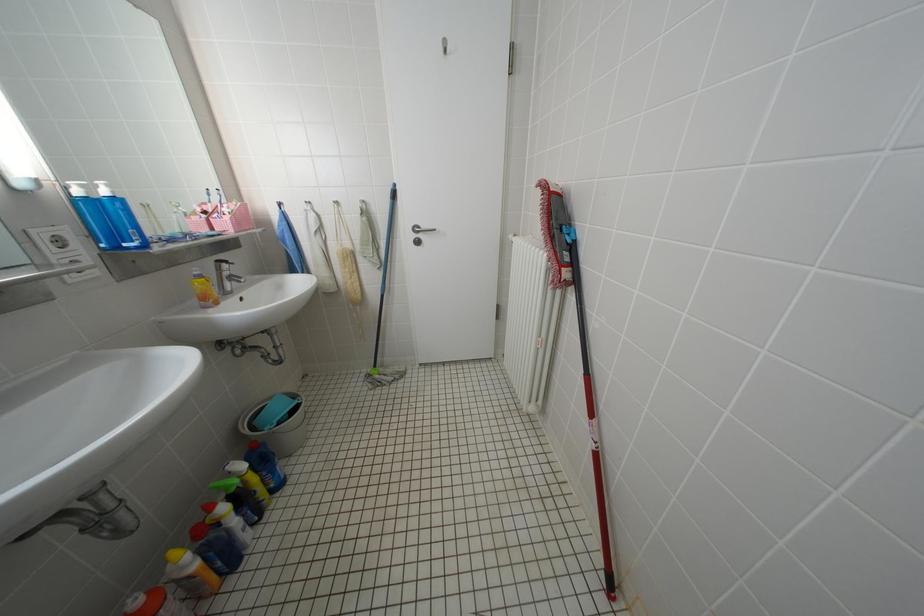
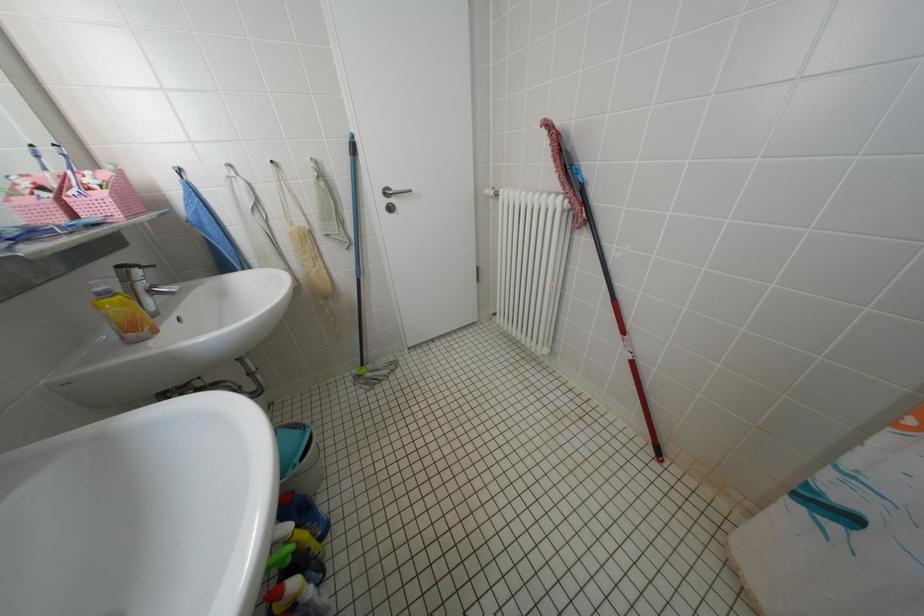
Question: The camera is either moving clockwise (left) or counter-clockwise (right) around the object. The first image is from the beginning of the video and the second image is from the end. Is the camera moving left or right when shooting the video?

Choices:
 (A) Left
 (B) Right

Answer: (A)